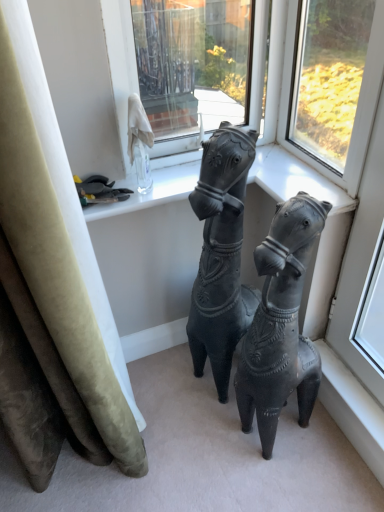
Question: From a real-world perspective, is transparent glass window at upper center, the first window positioned from the right, positioned over transparent glass window at upper center, marked as the second window in a right-to-left arrangement, based on gravity?

Choices:
 (A) no
 (B) yes

Answer: (A)

Question: Is transparent glass window at upper center, marked as the second window in a left-to-right arrangement, behind transparent glass window at upper center, marked as the second window in a right-to-left arrangement?

Choices:
 (A) yes
 (B) no

Answer: (B)

Question: Is there a large distance between transparent glass window at upper center, marked as the second window in a left-to-right arrangement, and transparent glass window at upper center, which is the first window in left-to-right order?

Choices:
 (A) yes
 (B) no

Answer: (A)

Question: Is the depth of transparent glass window at upper center, the first window positioned from the right, less than that of transparent glass window at upper center, marked as the second window in a right-to-left arrangement?

Choices:
 (A) yes
 (B) no

Answer: (A)

Question: Can you confirm if transparent glass window at upper center, marked as the second window in a left-to-right arrangement, is taller than transparent glass window at upper center, which is the first window in left-to-right order?

Choices:
 (A) yes
 (B) no

Answer: (B)

Question: Is transparent glass window at upper center, marked as the second window in a left-to-right arrangement, smaller than transparent glass window at upper center, which is the first window in left-to-right order?

Choices:
 (A) yes
 (B) no

Answer: (A)

Question: Is matte black horse at center behind transparent glass window at upper center, marked as the second window in a left-to-right arrangement?

Choices:
 (A) no
 (B) yes

Answer: (A)

Question: Is matte black horse at center positioned with its back to transparent glass window at upper center, marked as the second window in a left-to-right arrangement?

Choices:
 (A) yes
 (B) no

Answer: (B)

Question: Does matte black horse at center have a lesser width compared to transparent glass window at upper center, marked as the second window in a left-to-right arrangement?

Choices:
 (A) no
 (B) yes

Answer: (A)

Question: Does matte black horse at center turn towards transparent glass window at upper center, the first window positioned from the right?

Choices:
 (A) no
 (B) yes

Answer: (A)

Question: Is matte black horse at center located outside transparent glass window at upper center, the first window positioned from the right?

Choices:
 (A) no
 (B) yes

Answer: (B)

Question: From the image's perspective, would you say matte black horse at center is shown under transparent glass window at upper center, marked as the second window in a left-to-right arrangement?

Choices:
 (A) yes
 (B) no

Answer: (A)

Question: Is the position of transparent glass window at upper center, which is the first window in left-to-right order, less distant than that of matte black horse at center?

Choices:
 (A) no
 (B) yes

Answer: (A)